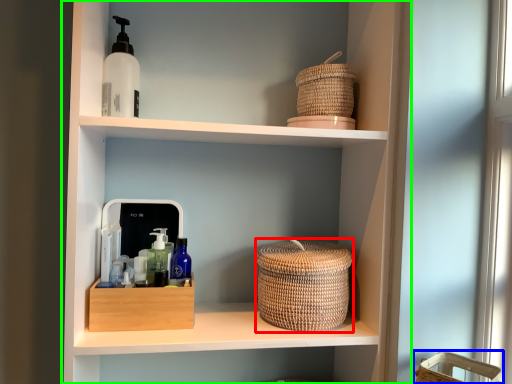
Question: Which object is the farthest from basket container (highlighted by a red box)? Choose among these: basket (highlighted by a blue box) or shelf (highlighted by a green box).

Choices:
 (A) basket
 (B) shelf

Answer: (A)